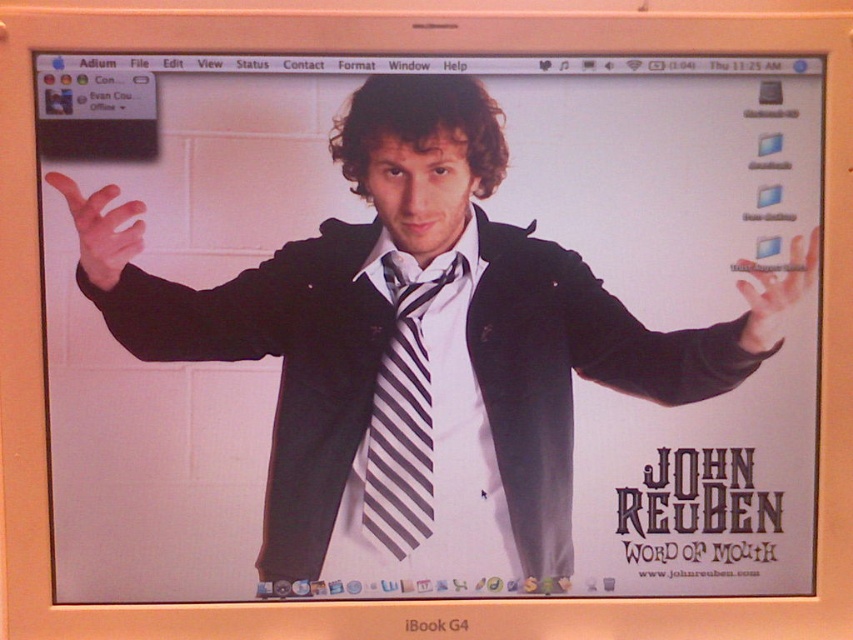
Is black striped tie at center positioned before matte black hand at right?

No.

Can you confirm if black striped tie at center is shorter than matte black hand at right?

No, black striped tie at center is not shorter than matte black hand at right.

Does point (413, 541) come closer to viewer compared to point (801, 236)?

No, it is not.

The width and height of the screenshot is (853, 640). I want to click on black striped tie at center, so click(402, 419).

Who is higher up, black striped tie at center or matte black hand at left?

matte black hand at left is above.

How distant is black striped tie at center from matte black hand at left?

black striped tie at center is 11.16 inches away from matte black hand at left.

Is point (386, 356) more distant than point (120, 252)?

Yes, point (386, 356) is behind point (120, 252).

This screenshot has width=853, height=640. What are the coordinates of `black striped tie at center` in the screenshot? It's located at (402, 419).

Is matte black hand at left positioned behind matte black hand at right?

No, it is in front of matte black hand at right.

Looking at this image, who is positioned more to the right, matte black hand at left or matte black hand at right?

Positioned to the right is matte black hand at right.

Describe the element at coordinates (102, 228) in the screenshot. I see `matte black hand at left` at that location.

At what (x,y) coordinates should I click in order to perform the action: click on matte black hand at left. Please return your answer as a coordinate pair (x, y). The height and width of the screenshot is (640, 853). Looking at the image, I should click on (102, 228).